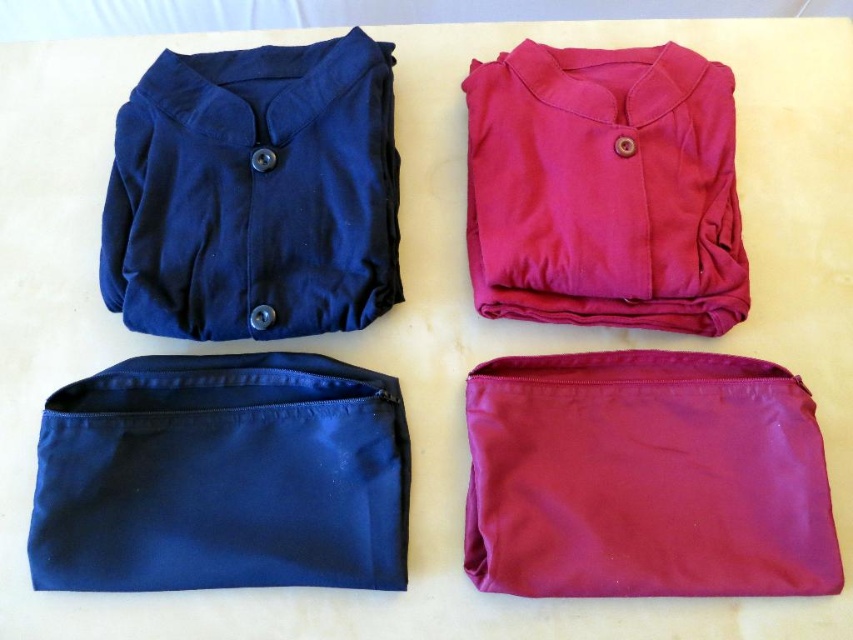
You are looking at the image and want to determine which of the two points, point (125, 493) or point (378, 141), is closer to you. Based on the description, which point is nearer?

Point (125, 493) is closer to the viewer than point (378, 141).

You are organizing a drawer and need to place the navy blue fabric pouch at lower left and the matte pink fabric shirt at upper right. Based on their positions in the image, which item is located to the left of the other?

The navy blue fabric pouch at lower left is positioned on the left side of matte pink fabric shirt at upper right, so the navy blue fabric pouch at lower left is to the left of the matte pink fabric shirt at upper right.

You are organizing a drawer and need to place the navy blue fabric pouch at lower left and the matte blue fabric shirt at upper left. Which item requires more horizontal space in the drawer?

The navy blue fabric pouch at lower left requires more horizontal space in the drawer since its width is greater than the matte blue fabric shirt at upper left.